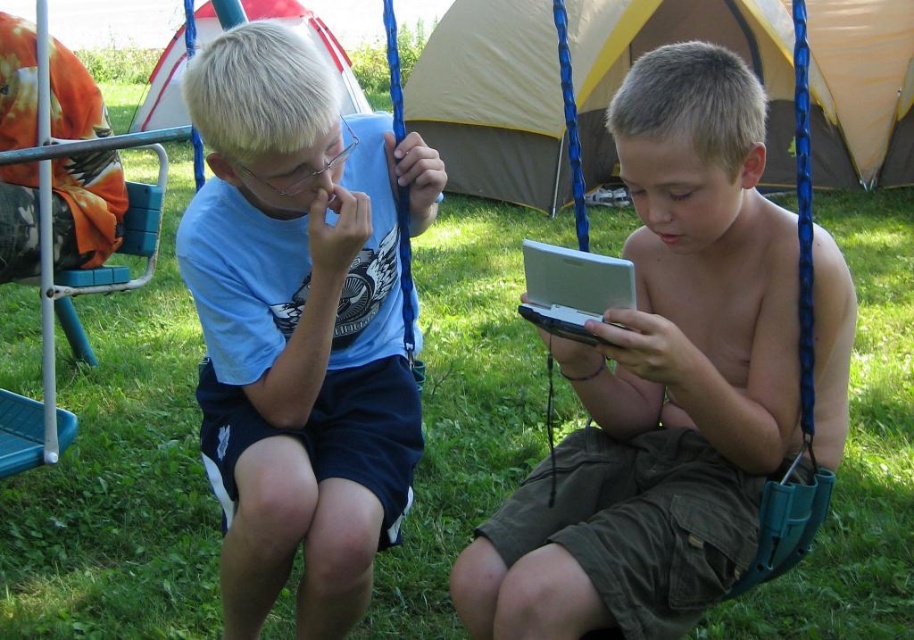
Is red and white striped tent at upper left positioned behind white matte handheld device at right?

Yes, it is.

This screenshot has width=914, height=640. I want to click on red and white striped tent at upper left, so [x=174, y=74].

The image size is (914, 640). Describe the element at coordinates (661, 385) in the screenshot. I see `matte silver handheld device at center` at that location.

Who is more distant from viewer, [760,102] or [523,307]?

Positioned behind is point [523,307].

At what (x,y) coordinates should I click in order to perform the action: click on matte silver handheld device at center. Please return your answer as a coordinate pair (x, y). Looking at the image, I should click on (661, 385).

Who is more distant from viewer, (744, 284) or (198, 259)?

Positioned behind is point (198, 259).

Does matte silver handheld device at center come in front of blue matte shirt at left?

Yes, it is in front of blue matte shirt at left.

Measure the distance between point [666,538] and camera.

They are 1.25 meters apart.

Identify the location of matte silver handheld device at center. (661, 385).